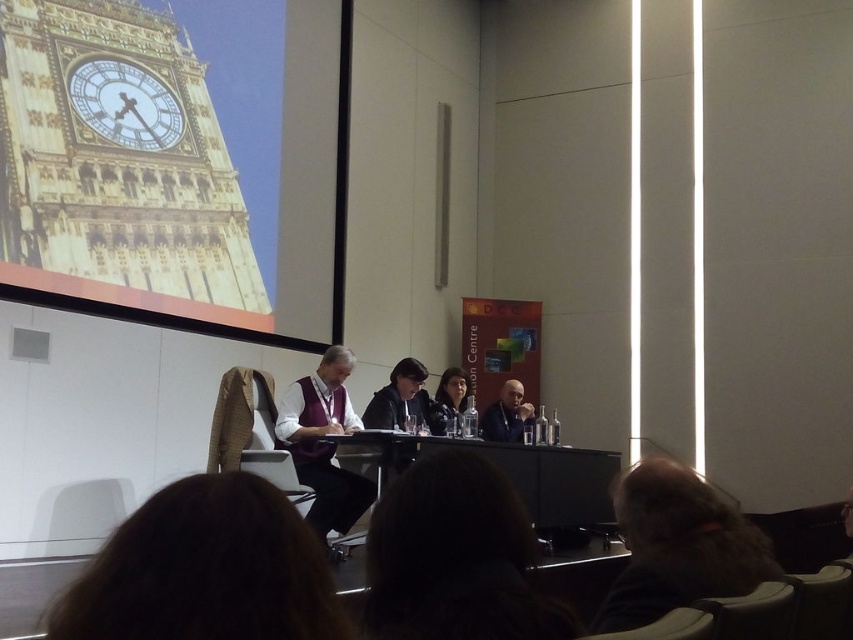
Question: Estimate the real-world distances between objects in this image. Which object is farther from the purple velvet vest at center?

Choices:
 (A) dark brown hair at lower center
 (B) matte black hair at center

Answer: (A)

Question: Is golden stone clock tower at upper left smaller than dark brown hair at lower right?

Choices:
 (A) yes
 (B) no

Answer: (B)

Question: Among these objects, which one is farthest from the camera?

Choices:
 (A) dark brown hair at lower center
 (B) matte black hair at center
 (C) black glossy table at center
 (D) gold metallic clock at upper left

Answer: (B)

Question: Which of the following is the farthest from the observer?

Choices:
 (A) (103, 588)
 (B) (286, 401)
 (C) (135, 81)
 (D) (461, 387)

Answer: (D)

Question: Can you confirm if brown hair at lower center is positioned to the left of matte black hair at center?

Choices:
 (A) yes
 (B) no

Answer: (A)

Question: Can you confirm if dark brown hair at lower right is positioned to the right of purple velvet vest at center?

Choices:
 (A) yes
 (B) no

Answer: (A)